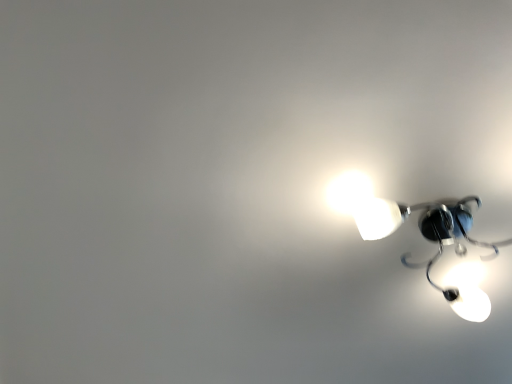
Image resolution: width=512 pixels, height=384 pixels. I want to click on chrome/textured lamp at upper right, so click(x=424, y=236).

Measure the distance between chrome/textured lamp at upper right and camera.

The depth of chrome/textured lamp at upper right is 1.10 meters.

Describe the element at coordinates (424, 236) in the screenshot. This screenshot has height=384, width=512. I see `chrome/textured lamp at upper right` at that location.

Locate an element on the screen. The height and width of the screenshot is (384, 512). chrome/textured lamp at upper right is located at coordinates (424, 236).